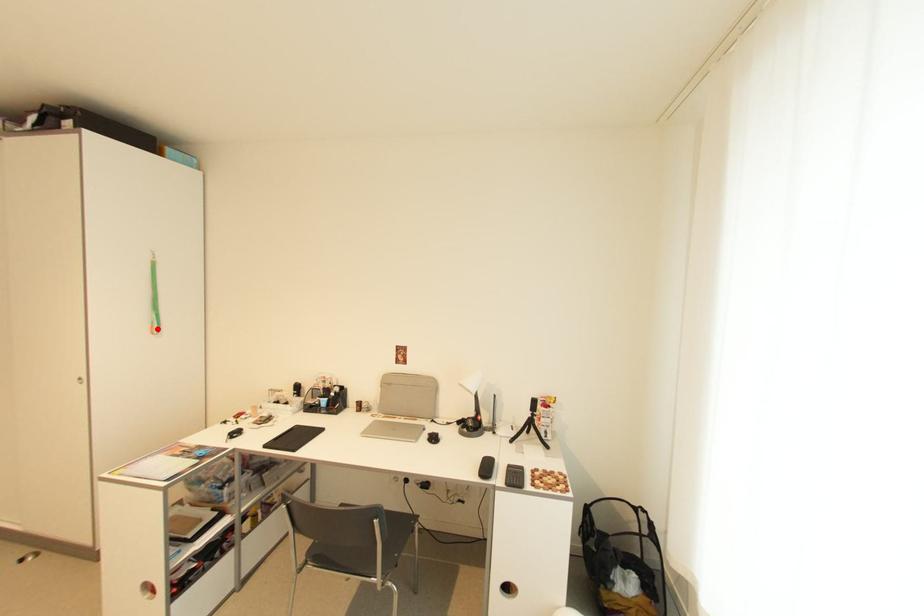
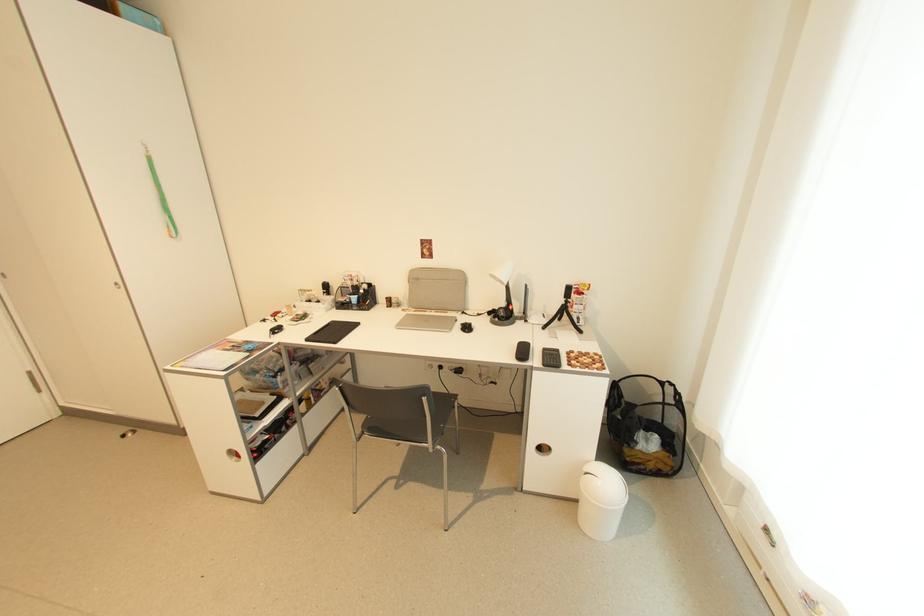
Find the pixel in the second image that matches the highlighted location in the first image.

(175, 233)